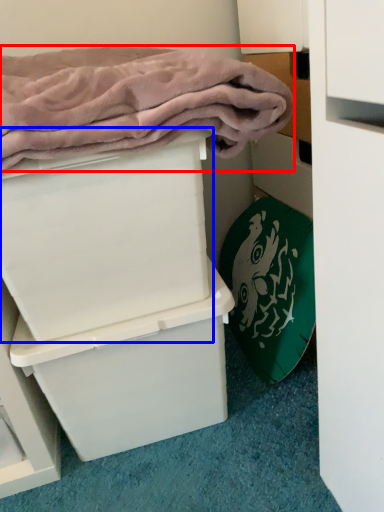
Question: Which object is further to the camera taking this photo, bath towel (highlighted by a red box) or box (highlighted by a blue box)?

Choices:
 (A) bath towel
 (B) box

Answer: (B)